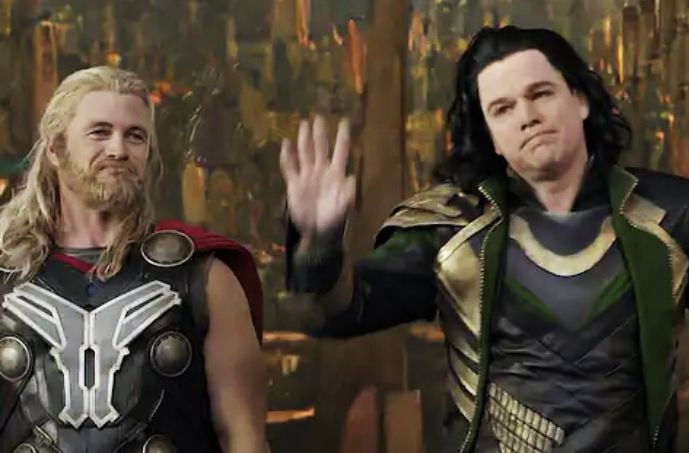
Identify the location of brown, dark green and dark yellow wall. The image size is (689, 453). (300, 87), (382, 90).